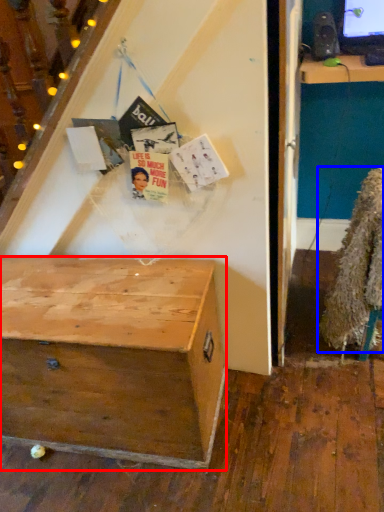
Question: Among these objects, which one is nearest to the camera, desk (highlighted by a red box) or fur coat (highlighted by a blue box)?

Choices:
 (A) desk
 (B) fur coat

Answer: (A)